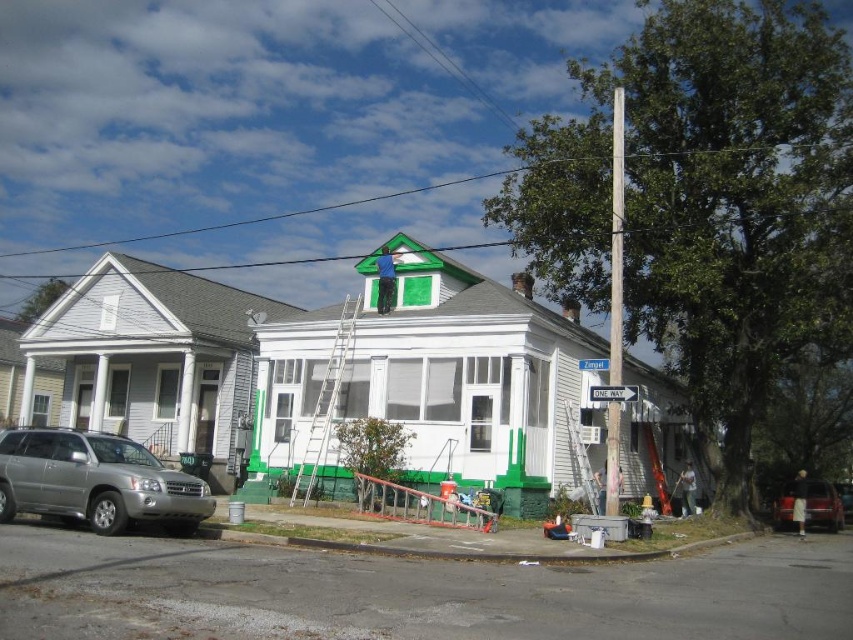
Question: Is smooth wood pole at right thinner than blue plastic street sign at upper center?

Choices:
 (A) no
 (B) yes

Answer: (A)

Question: Which point is closer to the camera taking this photo?

Choices:
 (A) (131, 474)
 (B) (785, 497)
 (C) (595, 369)
 (D) (619, 392)

Answer: (A)

Question: Can you confirm if smooth wood pole at right is positioned above white plastic street sign at upper center?

Choices:
 (A) no
 (B) yes

Answer: (B)

Question: Estimate the real-world distances between objects in this image. Which object is farther from the blue plastic street sign at upper center?

Choices:
 (A) white plastic street sign at upper center
 (B) metallic red car at lower right

Answer: (B)

Question: Which object is positioned closest to the white plastic street sign at upper center?

Choices:
 (A) silver metallic suv at lower left
 (B) blue plastic street sign at upper center

Answer: (B)

Question: Does metallic red car at lower right come in front of blue plastic street sign at upper center?

Choices:
 (A) yes
 (B) no

Answer: (B)